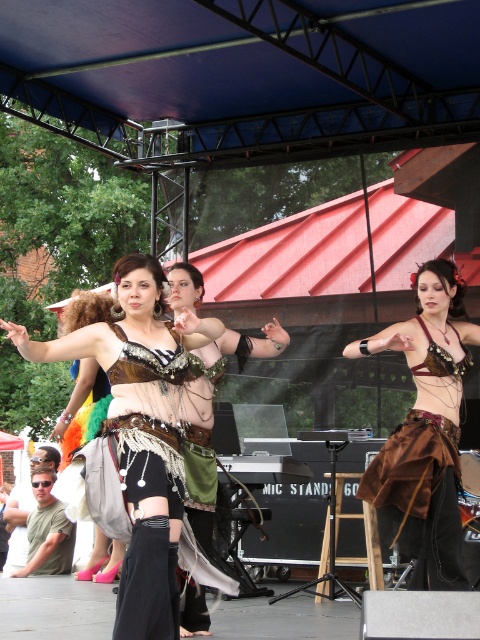
From the picture: You are a photographer at the event and need to capture a closeup of both the brown velvet skirt at center and the shiny metallic bra at center. Given that your camera can only focus on one object at a time, which object should you adjust the focus to first to ensure it appears sharp in the photo?

The brown velvet skirt at center has a larger size compared to the shiny metallic bra at center, so you should focus on the brown velvet skirt at center first as it requires more detailed focus due to its larger size.

You are a costume designer preparing for a performance and need to ensure that the shiny metallic bra at center is visible to the audience. Given that the shiny silver belt at center is larger in size, will the belt potentially block the view of the bra?

The shiny silver belt at center is larger in size than the shiny metallic bra at center, so it might block the view of the bra depending on how they are positioned during the dance.